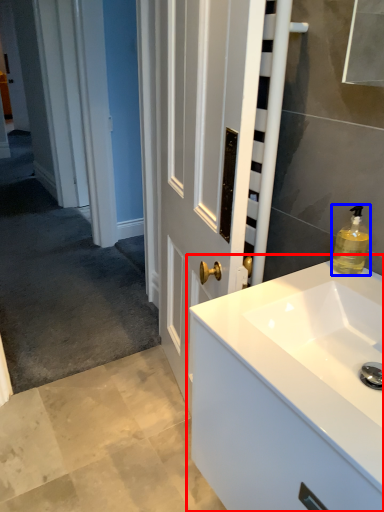
Question: Which object appears closest to the camera in this image, bathroom cabinet (highlighted by a red box) or soap dispenser (highlighted by a blue box)?

Choices:
 (A) bathroom cabinet
 (B) soap dispenser

Answer: (A)